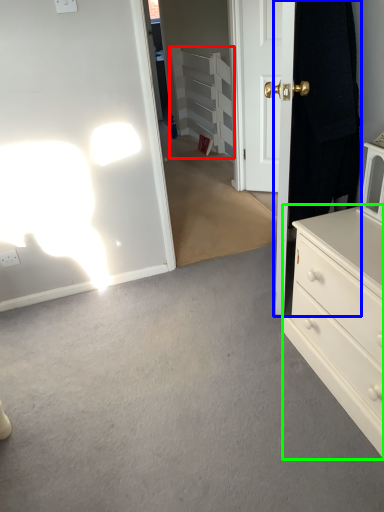
Question: Which object is positioned closest to armoire (highlighted by a red box)? Select from door (highlighted by a blue box) and chest of drawers (highlighted by a green box).

Choices:
 (A) door
 (B) chest of drawers

Answer: (A)